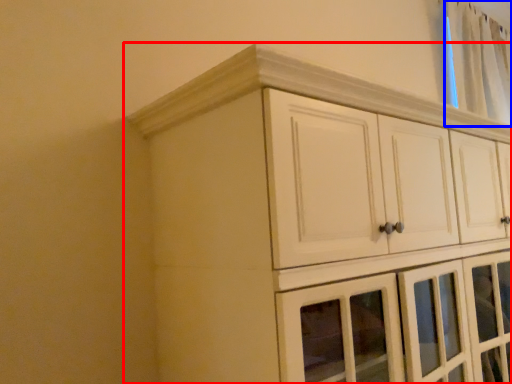
Question: Which object is closer to the camera taking this photo, cupboard (highlighted by a red box) or curtain (highlighted by a blue box)?

Choices:
 (A) cupboard
 (B) curtain

Answer: (A)